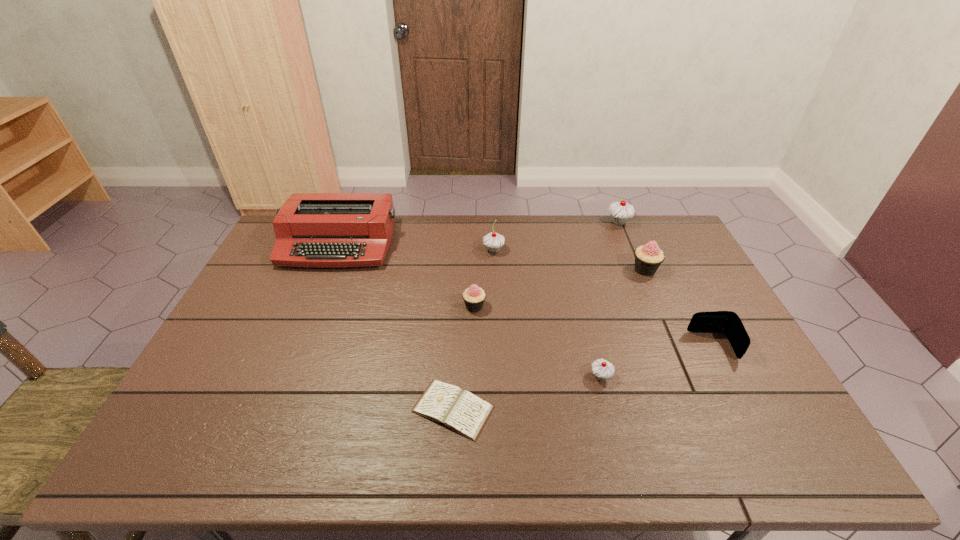
This screenshot has width=960, height=540. I want to click on the farthest gray cupcake, so click(620, 212).

Where is `the biggest gray cupcake`? the biggest gray cupcake is located at coordinates (620, 212).

The width and height of the screenshot is (960, 540). What are the coordinates of `the leftmost object` in the screenshot? It's located at (317, 230).

The height and width of the screenshot is (540, 960). In order to click on red typewriter in this screenshot , I will do `click(317, 230)`.

You are a GUI agent. You are given a task and a screenshot of the screen. Output one action in this format:
    pyautogui.click(x=<x>, y=<y>)
    Task: Click on the leftmost gray cupcake
    The image size is (960, 540).
    Given the screenshot: What is the action you would take?
    pyautogui.click(x=493, y=241)

Identify the location of the second smallest gray cupcake. The width and height of the screenshot is (960, 540). pos(493,241).

You are a GUI agent. You are given a task and a screenshot of the screen. Output one action in this format:
    pyautogui.click(x=<x>, y=<y>)
    Task: Click on the bigger pink cupcake
    This screenshot has height=540, width=960.
    Given the screenshot: What is the action you would take?
    pyautogui.click(x=648, y=258)

Image resolution: width=960 pixels, height=540 pixels. In order to click on the right pink cupcake in this screenshot , I will do coord(648,258).

This screenshot has width=960, height=540. I want to click on the nearer pink cupcake, so click(x=474, y=297).

Locate an element on the screen. This screenshot has height=540, width=960. the smaller pink cupcake is located at coordinates (474, 297).